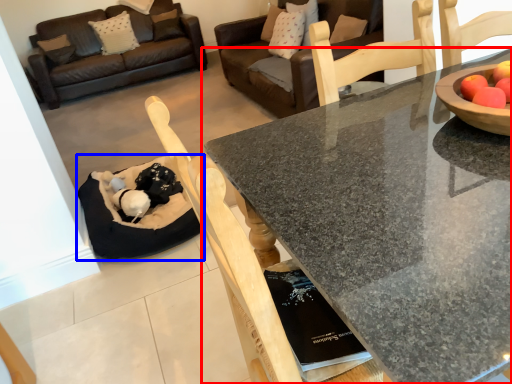
Question: Among these objects, which one is farthest to the camera, coffee table (highlighted by a red box) or cat bed (highlighted by a blue box)?

Choices:
 (A) coffee table
 (B) cat bed

Answer: (B)